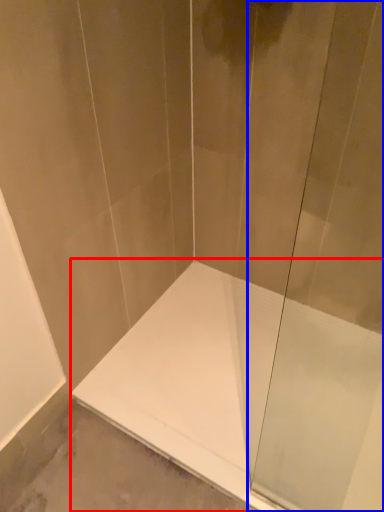
Question: Among these objects, which one is farthest to the camera, bathtub (highlighted by a red box) or shower door (highlighted by a blue box)?

Choices:
 (A) bathtub
 (B) shower door

Answer: (A)